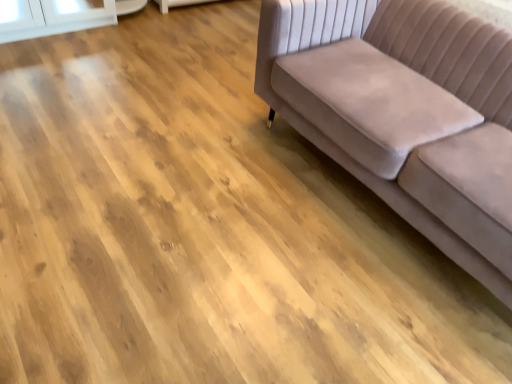
Image resolution: width=512 pixels, height=384 pixels. What do you see at coordinates (405, 113) in the screenshot?
I see `velvet beige couch at right` at bounding box center [405, 113].

Image resolution: width=512 pixels, height=384 pixels. I want to click on velvet beige couch at right, so click(x=405, y=113).

Where is `velvet beige couch at right`? This screenshot has height=384, width=512. velvet beige couch at right is located at coordinates (405, 113).